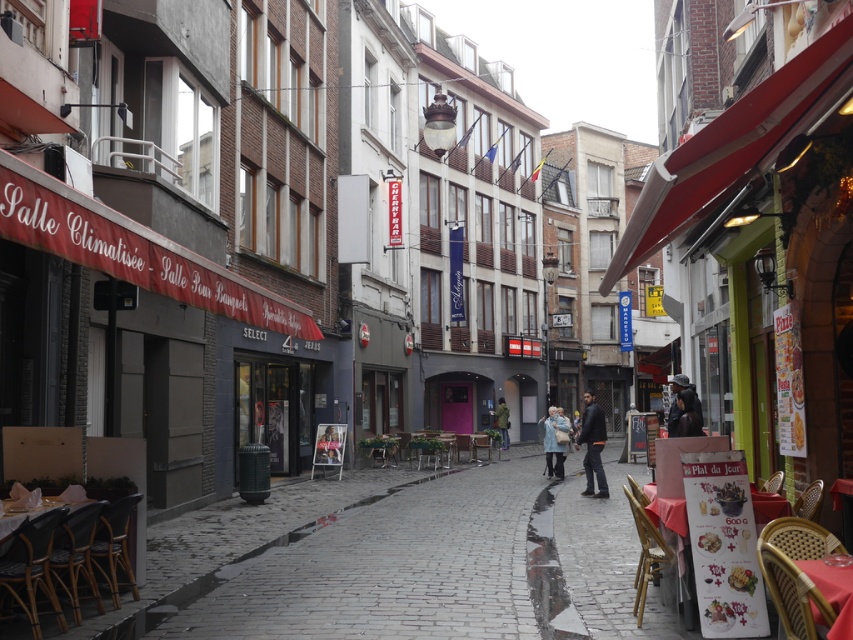
Question: Is light blue denim jacket at center bigger than green fabric jacket at center?

Choices:
 (A) no
 (B) yes

Answer: (A)

Question: Considering the real-world distances, which object is closest to the dark brown leather jacket at center?

Choices:
 (A) green fabric jacket at center
 (B) light blue denim jacket at center

Answer: (B)

Question: Which point is closer to the camera taking this photo?

Choices:
 (A) (502, 445)
 (B) (584, 465)

Answer: (B)

Question: Can you confirm if dark gray jacket at center is positioned below dark brown leather jacket at center?

Choices:
 (A) no
 (B) yes

Answer: (B)

Question: Among these points, which one is farthest from the camera?

Choices:
 (A) (566, 429)
 (B) (602, 428)
 (C) (503, 422)
 (D) (692, 397)

Answer: (C)

Question: Is dark brown leather jacket at center below light blue denim jacket at center?

Choices:
 (A) no
 (B) yes

Answer: (A)